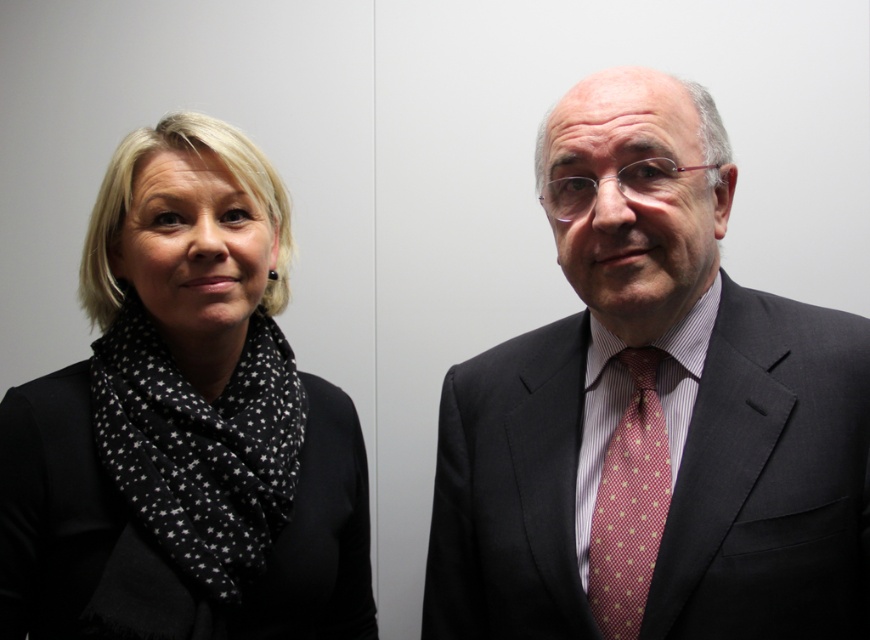
You are a photographer setting up a shoot with two people. You have a black dotted scarf at left and a pink dotted fabric tie at center. You want to ensure that the scarf is visible in the frame without overlapping the tie. Based on their positions, can you confirm if the scarf is positioned to the left of the tie?

Yes, the black dotted scarf at left is positioned to the left of the pink dotted fabric tie at center, so they are not overlapping and the scarf is visible in the frame.

You are a photographer adjusting the focus on your camera. You notice two points in the image at coordinates point (614, 374) and point (634, 348). Which point should you focus on to ensure the closest object is sharp?

You should focus on point (614, 374) because it is closer to the viewer than point (634, 348), making it the nearest object in the scene.